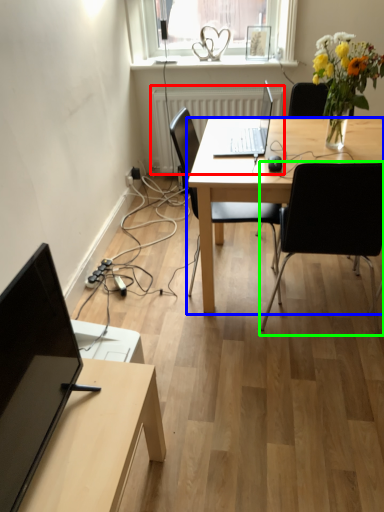
Question: Which object is positioned closest to radiator (highlighted by a red box)? Select from desk (highlighted by a blue box) and chair (highlighted by a green box).

Choices:
 (A) desk
 (B) chair

Answer: (A)